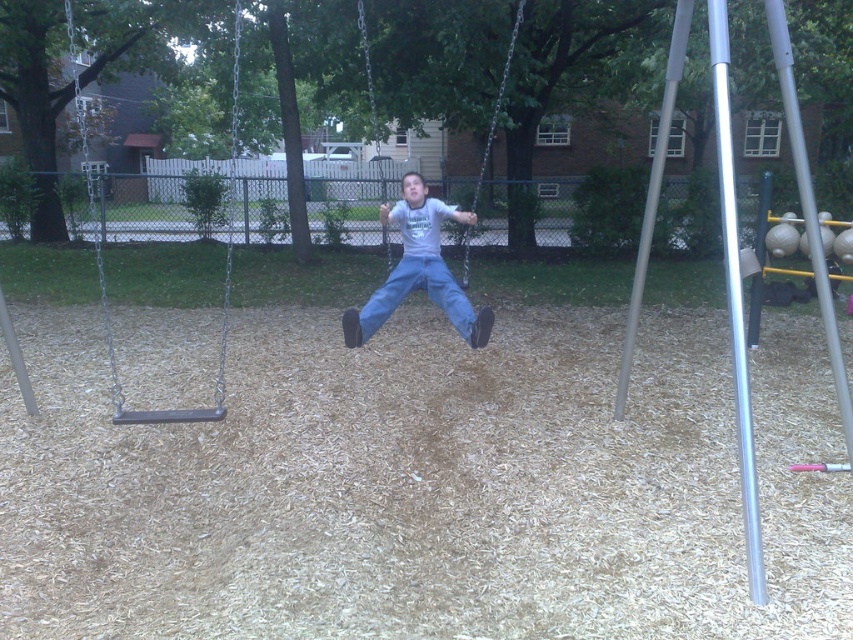
Is light blue jeans at center thinner than blue denim jeans at center?

No, light blue jeans at center is not thinner than blue denim jeans at center.

Who is more forward, (x=445, y=304) or (x=456, y=326)?

Point (x=456, y=326) is more forward.

At what (x,y) coordinates should I click in order to perform the action: click on light blue jeans at center. Please return your answer as a coordinate pair (x, y). The width and height of the screenshot is (853, 640). Looking at the image, I should click on (418, 269).

How distant is light blue jeans at center from metallic swing at left?

light blue jeans at center is 26.58 feet from metallic swing at left.

Is light blue jeans at center further to the viewer compared to metallic swing at left?

Yes, it is.

Does point (445, 310) come in front of point (171, 412)?

No.

At what (x,y) coordinates should I click in order to perform the action: click on light blue jeans at center. Please return your answer as a coordinate pair (x, y). This screenshot has height=640, width=853. Looking at the image, I should click on (418, 269).

Does metallic swing at left have a lesser height compared to blue denim jeans at center?

Incorrect, metallic swing at left's height does not fall short of blue denim jeans at center's.

Is metallic swing at left taller than blue denim jeans at center?

Yes.

Between point (106, 328) and point (469, 337), which one is positioned behind?

Point (106, 328)

The image size is (853, 640). I want to click on metallic swing at left, so click(x=102, y=259).